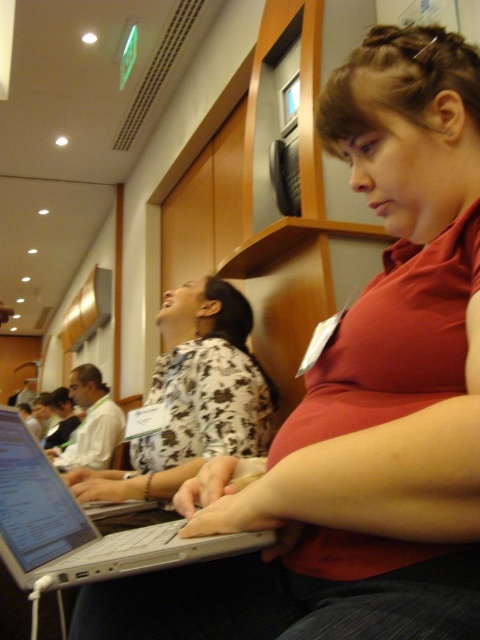
Can you confirm if white floral shirt at center is smaller than silver metallic laptop at center?

No, white floral shirt at center is not smaller than silver metallic laptop at center.

Looking at this image, measure the distance from white floral shirt at center to silver metallic laptop at center.

white floral shirt at center and silver metallic laptop at center are 21.72 inches apart.

Is point (126, 472) more distant than point (101, 572)?

Yes.

Identify the location of white floral shirt at center. (193, 396).